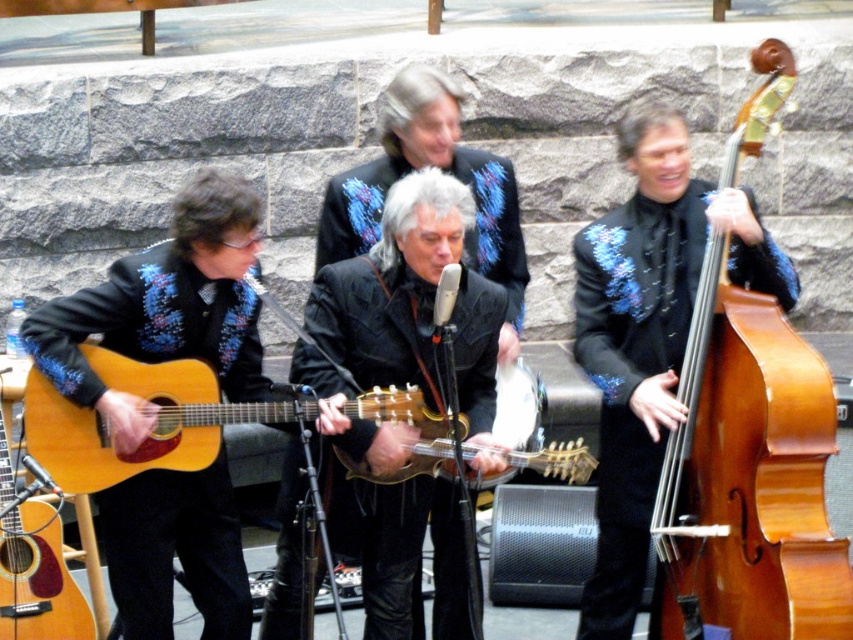
You are a photographer standing at the camera position. You want to take a closeup shot of the light brown wood guitar at center. Can you reach the guitar with a standard 100mm lens? Please explain your reasoning.

The light brown wood guitar at center and the camera are 3.75 meters apart. A standard 100mm lens has a focal length that allows for a closeup shot from this distance, so yes, you can capture the guitar clearly with the 100mm lens.

You are setting up a music stand between the light brown wood guitar at center and the matte wood guitar at left. Which guitar should the stand be placed closer to if you want it to be equidistant from both guitars?

The stand should be placed closer to the light brown wood guitar at center because it might be wider than the matte wood guitar at left, so the center point between them would require adjusting for their widths to maintain equal distance.